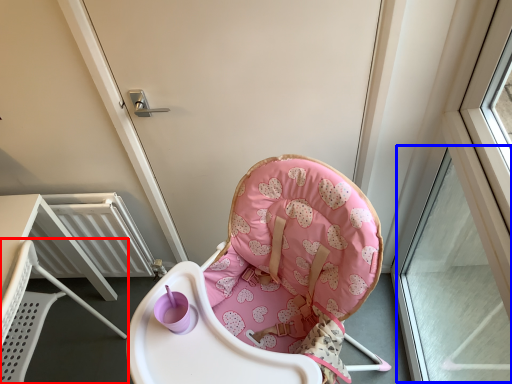
Question: Among these objects, which one is farthest to the camera, chair (highlighted by a red box) or window (highlighted by a blue box)?

Choices:
 (A) chair
 (B) window

Answer: (A)